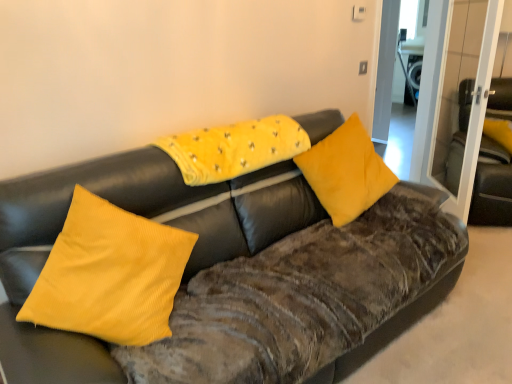
Question: Does yellow corduroy pillow at center, acting as the 1th pillow starting from the right, have a lesser height compared to yellow corduroy pillow at left, acting as the 3th pillow starting from the right?

Choices:
 (A) yes
 (B) no

Answer: (A)

Question: Is yellow corduroy pillow at center, acting as the 1th pillow starting from the right, far away from yellow corduroy pillow at left, acting as the 3th pillow starting from the right?

Choices:
 (A) yes
 (B) no

Answer: (A)

Question: From the image's perspective, is yellow corduroy pillow at center, acting as the 1th pillow starting from the right, above yellow corduroy pillow at left, acting as the 3th pillow starting from the right?

Choices:
 (A) yes
 (B) no

Answer: (A)

Question: Is yellow corduroy pillow at center, which appears as the 3th pillow when viewed from the left, to the left of yellow corduroy pillow at left, acting as the 3th pillow starting from the right, from the viewer's perspective?

Choices:
 (A) no
 (B) yes

Answer: (A)

Question: Is yellow corduroy pillow at center, which appears as the 3th pillow when viewed from the left, facing away from yellow corduroy pillow at left, acting as the 3th pillow starting from the right?

Choices:
 (A) no
 (B) yes

Answer: (A)

Question: Is yellow corduroy pillow at left, marked as the 1th pillow in a left-to-right arrangement, taller or shorter than yellow corduroy pillow at center, acting as the 1th pillow starting from the right?

Choices:
 (A) tall
 (B) short

Answer: (A)

Question: Visually, is yellow corduroy pillow at left, marked as the 1th pillow in a left-to-right arrangement, positioned to the left or to the right of yellow corduroy pillow at center, acting as the 1th pillow starting from the right?

Choices:
 (A) left
 (B) right

Answer: (A)

Question: Is yellow corduroy pillow at left, acting as the 3th pillow starting from the right, inside or outside of yellow corduroy pillow at center, which appears as the 3th pillow when viewed from the left?

Choices:
 (A) outside
 (B) inside

Answer: (A)

Question: Based on their sizes in the image, would you say yellow corduroy pillow at left, acting as the 3th pillow starting from the right, is bigger or smaller than yellow corduroy pillow at center, acting as the 1th pillow starting from the right?

Choices:
 (A) small
 (B) big

Answer: (B)

Question: Is point [x=494, y=221] positioned closer to the camera than point [x=14, y=365]?

Choices:
 (A) closer
 (B) farther

Answer: (B)

Question: Is velvet black armchair at right inside or outside of velvet brown couch at center?

Choices:
 (A) inside
 (B) outside

Answer: (B)

Question: From a real-world perspective, relative to velvet brown couch at center, is velvet black armchair at right vertically above or below?

Choices:
 (A) below
 (B) above

Answer: (A)

Question: Looking at their shapes, would you say velvet black armchair at right is wider or thinner than velvet brown couch at center?

Choices:
 (A) thin
 (B) wide

Answer: (A)

Question: From the image's perspective, is yellow corduroy pillow at upper center, the second pillow in the right-to-left sequence, above or below yellow corduroy pillow at left, marked as the 1th pillow in a left-to-right arrangement?

Choices:
 (A) above
 (B) below

Answer: (A)

Question: Is yellow corduroy pillow at upper center, the second pillow in the right-to-left sequence, spatially inside yellow corduroy pillow at left, acting as the 3th pillow starting from the right, or outside of it?

Choices:
 (A) outside
 (B) inside

Answer: (A)